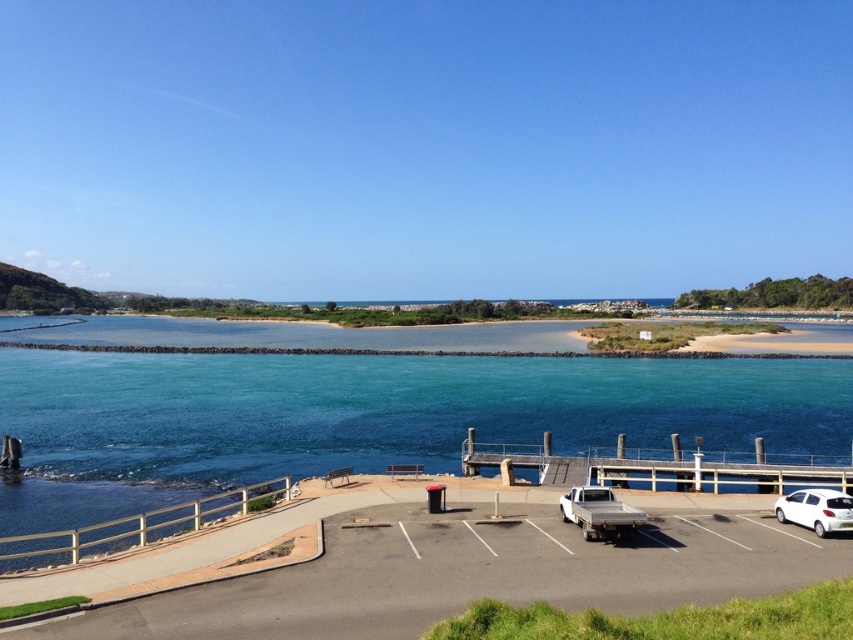
Is clear blue water at center behind white glossy hatchback at lower right?

That is False.

Who is lower down, clear blue water at center or white glossy hatchback at lower right?

white glossy hatchback at lower right is lower down.

Between point (219, 364) and point (810, 509), which one is positioned behind?

Point (219, 364)

You are a GUI agent. You are given a task and a screenshot of the screen. Output one action in this format:
    pyautogui.click(x=<x>, y=<y>)
    Task: Click on the clear blue water at center
    
    Given the screenshot: What is the action you would take?
    pyautogui.click(x=364, y=419)

Does wooden dock at center have a greater height compared to white glossy hatchback at lower right?

Yes, wooden dock at center is taller than white glossy hatchback at lower right.

What do you see at coordinates (663, 467) in the screenshot? I see `wooden dock at center` at bounding box center [663, 467].

Between point (730, 474) and point (827, 529), which one is positioned in front?

Point (827, 529)

The image size is (853, 640). In order to click on wooden dock at center in this screenshot , I will do `click(663, 467)`.

Does wooden dock at center have a larger size compared to white matte truck at lower right?

Yes, wooden dock at center is bigger than white matte truck at lower right.

Between wooden dock at center and white matte truck at lower right, which one is positioned higher?

Positioned higher is white matte truck at lower right.

I want to click on wooden dock at center, so click(663, 467).